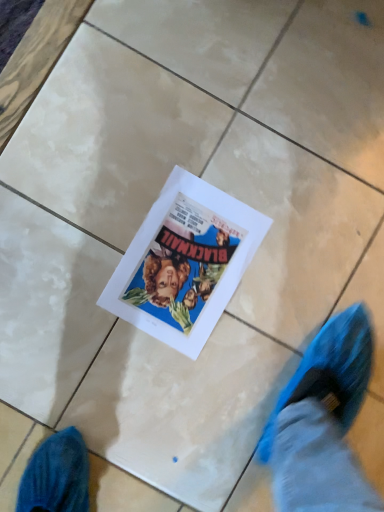
You are a GUI agent. You are given a task and a screenshot of the screen. Output one action in this format:
    pyautogui.click(x=<x>, y=<y>)
    Task: Click on the free space above white paper at center (from a real-world perspective)
    The image size is (384, 512).
    Given the screenshot: What is the action you would take?
    pyautogui.click(x=187, y=260)